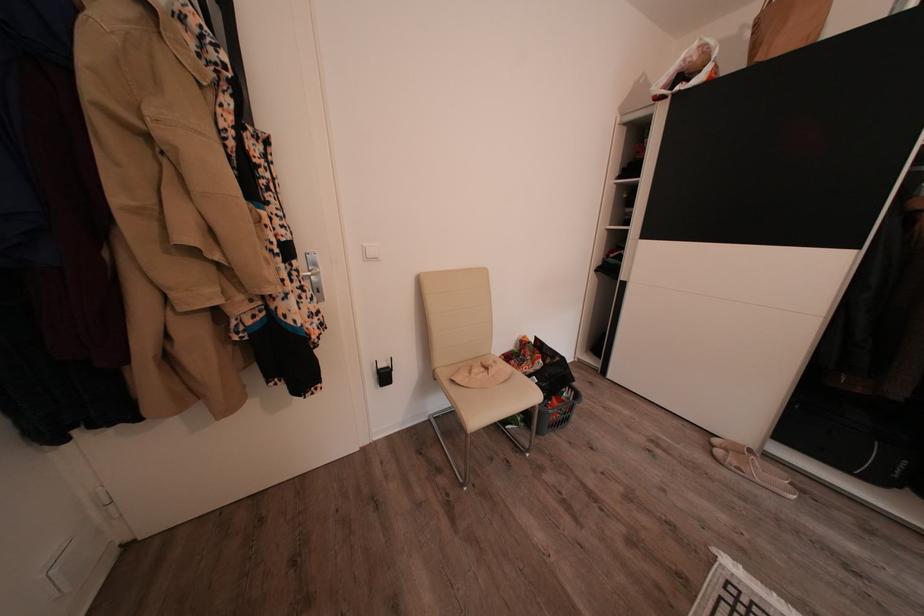
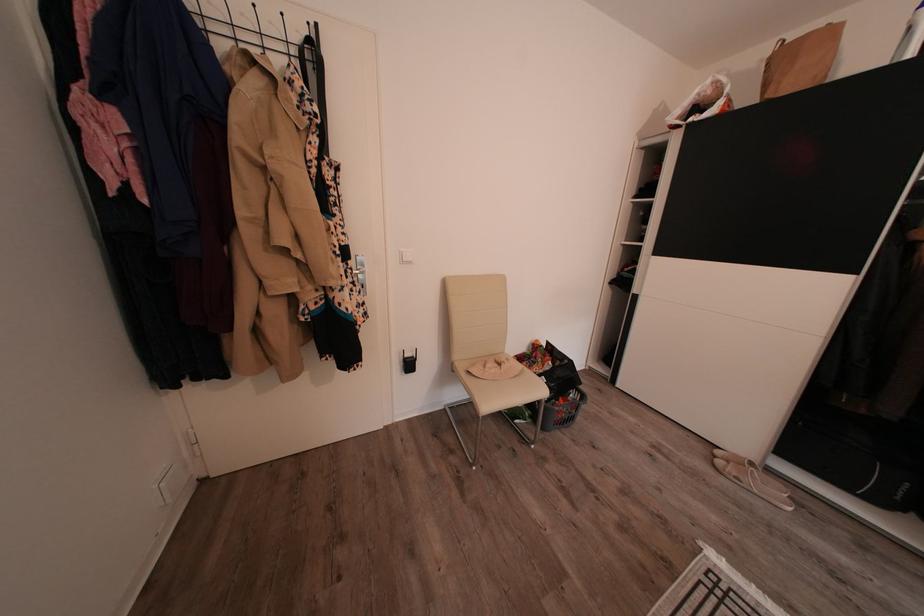
In the second image, find the point that corresponds to pixel 504 368 in the first image.

(516, 365)